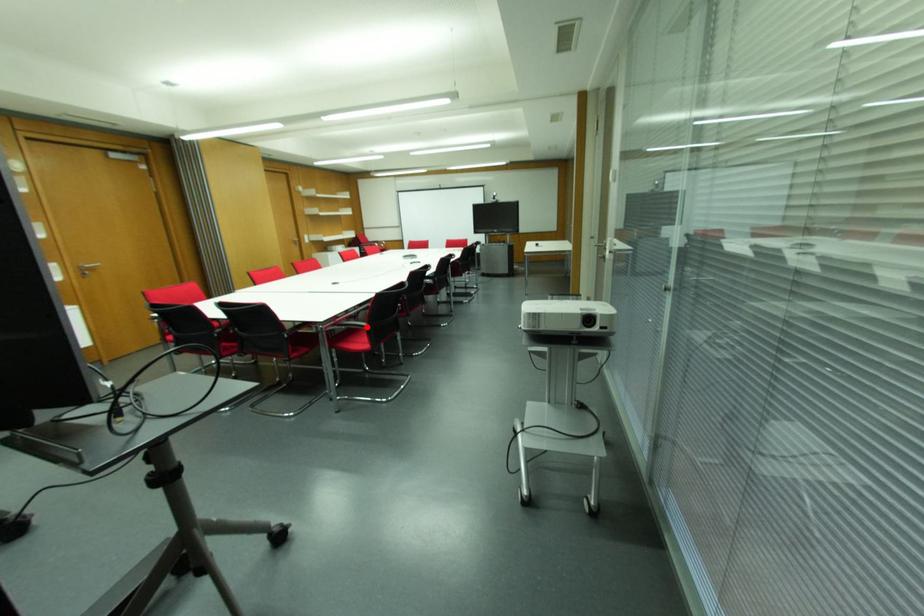
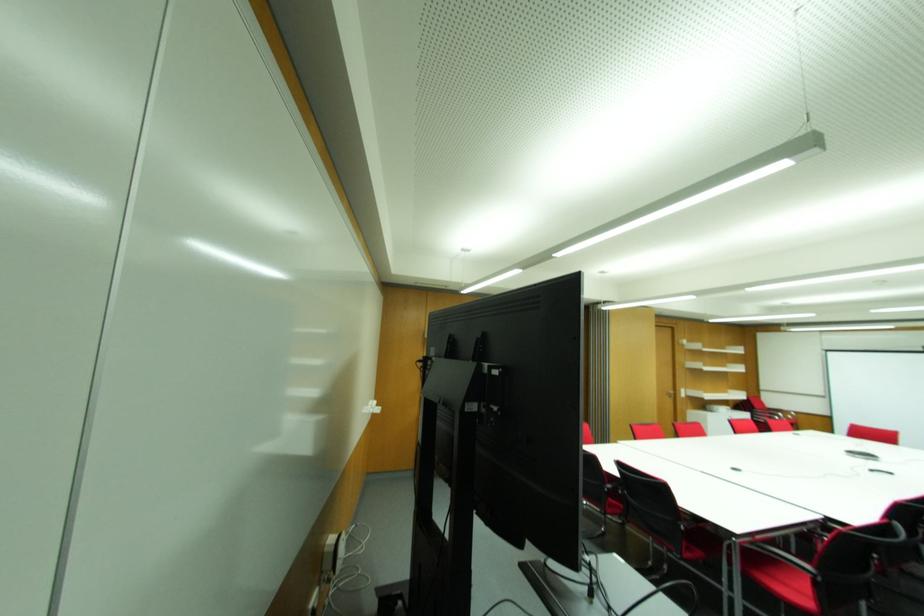
Question: I am providing you with two images of the same scene from different viewpoints. A red point is shown in image1. For the corresponding object point in image2, is it positioned nearer or farther from the camera?

Choices:
 (A) Nearer
 (B) Farther

Answer: (A)